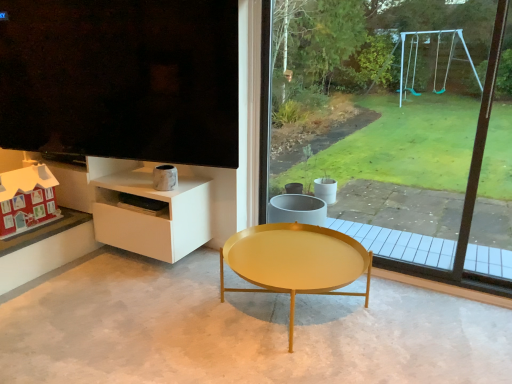
Question: From the image's perspective, is matte black screen at upper left located beneath transparent glass window at center?

Choices:
 (A) yes
 (B) no

Answer: (B)

Question: Can you confirm if matte black screen at upper left is thinner than transparent glass window at center?

Choices:
 (A) yes
 (B) no

Answer: (B)

Question: Is matte black screen at upper left positioned before transparent glass window at center?

Choices:
 (A) no
 (B) yes

Answer: (A)

Question: From a real-world perspective, is matte black screen at upper left physically above transparent glass window at center?

Choices:
 (A) no
 (B) yes

Answer: (B)

Question: Can you confirm if matte black screen at upper left is positioned to the left of transparent glass window at center?

Choices:
 (A) no
 (B) yes

Answer: (B)

Question: Can you confirm if matte black screen at upper left is taller than transparent glass window at center?

Choices:
 (A) yes
 (B) no

Answer: (B)

Question: From the image's perspective, does transparent glass window at center appear higher than white glossy shelf at lower left?

Choices:
 (A) yes
 (B) no

Answer: (A)

Question: From the image's perspective, is transparent glass window at center under white glossy shelf at lower left?

Choices:
 (A) yes
 (B) no

Answer: (B)

Question: Is transparent glass window at center surrounding white glossy shelf at lower left?

Choices:
 (A) yes
 (B) no

Answer: (B)

Question: Is transparent glass window at center smaller than white glossy shelf at lower left?

Choices:
 (A) yes
 (B) no

Answer: (B)

Question: Is transparent glass window at center bigger than white glossy shelf at lower left?

Choices:
 (A) yes
 (B) no

Answer: (A)

Question: From a real-world perspective, is transparent glass window at center physically below white glossy shelf at lower left?

Choices:
 (A) no
 (B) yes

Answer: (A)

Question: From a real-world perspective, is gold metallic coffee table at center on transparent glass window at center?

Choices:
 (A) yes
 (B) no

Answer: (B)